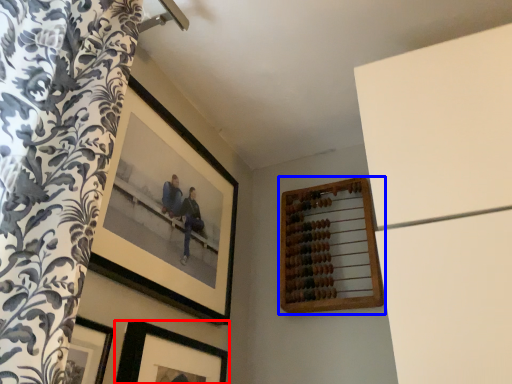
Question: Which point is closer to the camera, picture frame (highlighted by a red box) or picture frame (highlighted by a blue box)?

Choices:
 (A) picture frame
 (B) picture frame

Answer: (A)